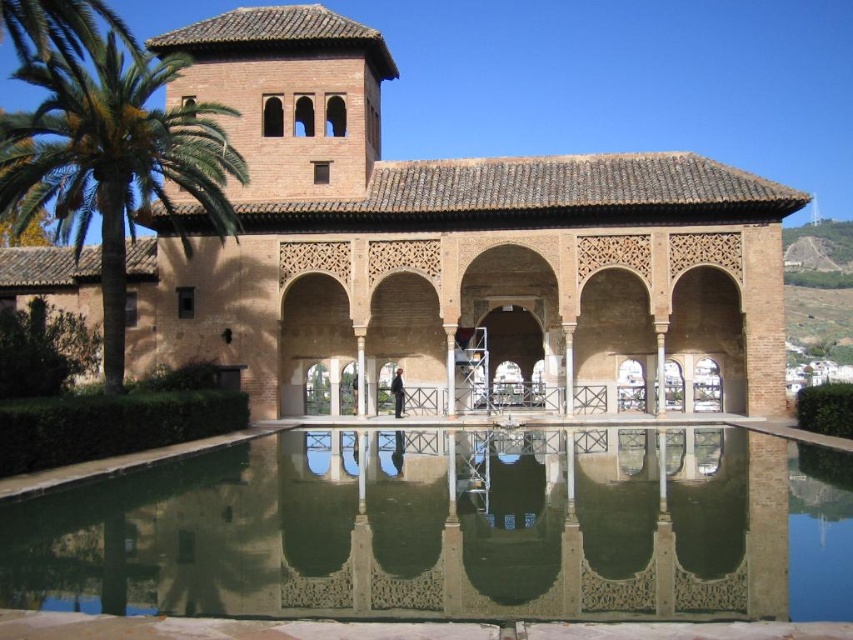
The height and width of the screenshot is (640, 853). Find the location of `green reflective water at center`. green reflective water at center is located at coordinates (451, 529).

Does green reflective water at center have a greater width compared to green leafy palm tree at left?

No.

Does point (183, 589) come closer to viewer compared to point (108, 67)?

Yes, point (183, 589) is closer to viewer.

Image resolution: width=853 pixels, height=640 pixels. Identify the location of green reflective water at center. (451, 529).

Is brown textured palace at center shorter than green leafy palm tree at left?

No.

Who is positioned more to the right, brown textured palace at center or green leafy palm tree at left?

From the viewer's perspective, brown textured palace at center appears more on the right side.

This screenshot has height=640, width=853. I want to click on brown textured palace at center, so coord(447,240).

Does brown textured palace at center have a greater width compared to green reflective water at center?

Correct, the width of brown textured palace at center exceeds that of green reflective water at center.

Describe the element at coordinates (447, 240) in the screenshot. I see `brown textured palace at center` at that location.

The height and width of the screenshot is (640, 853). Find the location of `brown textured palace at center`. brown textured palace at center is located at coordinates pos(447,240).

Where is `brown textured palace at center`? The image size is (853, 640). brown textured palace at center is located at coordinates (447, 240).